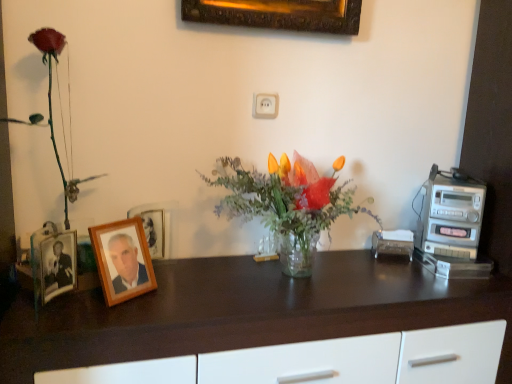
Where is `free space in front of wooden picture frame at left, arranged as the first picture frame when viewed from the back`? This screenshot has height=384, width=512. free space in front of wooden picture frame at left, arranged as the first picture frame when viewed from the back is located at coordinates (144, 300).